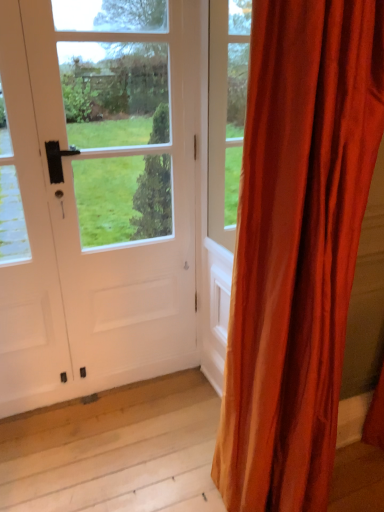
Question: Is point (x=301, y=211) positioned closer to the camera than point (x=8, y=229)?

Choices:
 (A) farther
 (B) closer

Answer: (B)

Question: Is satin orange curtain at right bigger or smaller than white matte door at center?

Choices:
 (A) big
 (B) small

Answer: (A)

Question: Is satin orange curtain at right wider or thinner than white matte door at center?

Choices:
 (A) wide
 (B) thin

Answer: (A)

Question: From the image's perspective, is white matte door at center located above or below satin orange curtain at right?

Choices:
 (A) below
 (B) above

Answer: (B)

Question: Which is correct: white matte door at center is inside satin orange curtain at right, or outside of it?

Choices:
 (A) outside
 (B) inside

Answer: (A)

Question: Considering their positions, is white matte door at center located in front of or behind satin orange curtain at right?

Choices:
 (A) behind
 (B) front

Answer: (A)

Question: Considering the relative positions of white matte door at center and satin orange curtain at right in the image provided, is white matte door at center to the left or to the right of satin orange curtain at right?

Choices:
 (A) right
 (B) left

Answer: (B)